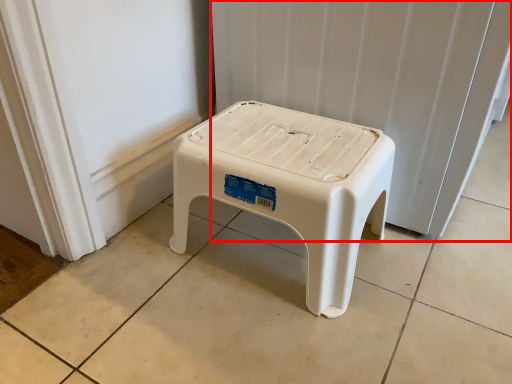
Question: From the image's perspective, where is radiator (annotated by the red box) located relative to stool?

Choices:
 (A) above
 (B) below

Answer: (A)